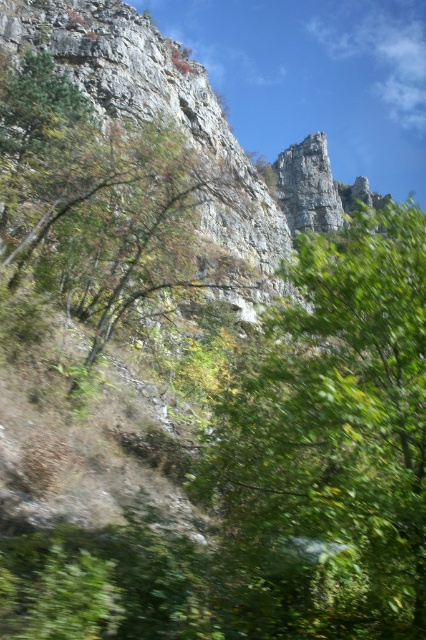
Is green leafy tree at center above green leafy tree at upper left?

Actually, green leafy tree at center is below green leafy tree at upper left.

Which is below, green leafy tree at center or green leafy tree at upper left?

green leafy tree at center is below.

Who is more forward, (267, 540) or (97, 292)?

Positioned in front is point (267, 540).

The image size is (426, 640). Identify the location of green leafy tree at center. (328, 445).